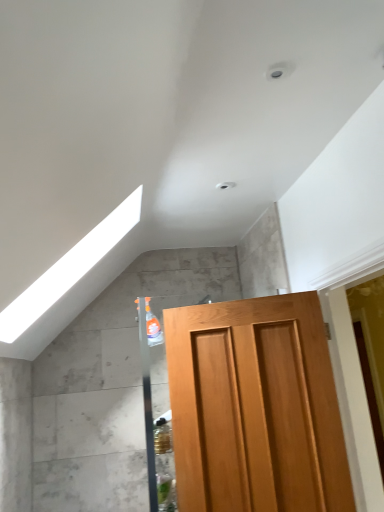
The width and height of the screenshot is (384, 512). What are the coordinates of `white glossy exhaust hood at upper left` in the screenshot? It's located at (69, 269).

In order to face white glossy exhaust hood at upper left, should I rotate leftwards or rightwards?

You should look left and rotate roughly 19.062 degrees.

What do you see at coordinates (69, 269) in the screenshot? I see `white glossy exhaust hood at upper left` at bounding box center [69, 269].

The width and height of the screenshot is (384, 512). What do you see at coordinates (255, 407) in the screenshot? I see `light brown wooden door at center` at bounding box center [255, 407].

Measure the distance between light brown wooden door at center and camera.

The distance of light brown wooden door at center from camera is 1.74 meters.

Find the location of a particular element. light brown wooden door at center is located at coordinates click(255, 407).

Where is `white glossy exhaust hood at upper left`? This screenshot has height=512, width=384. white glossy exhaust hood at upper left is located at coordinates (69, 269).

Between light brown wooden door at center and white glossy exhaust hood at upper left, which one appears on the left side from the viewer's perspective?

Positioned to the left is white glossy exhaust hood at upper left.

Relative to white glossy exhaust hood at upper left, is light brown wooden door at center in front or behind?

In the image, light brown wooden door at center appears behind white glossy exhaust hood at upper left.

Considering the positions of point (213, 366) and point (116, 229), is point (213, 366) closer or farther from the camera than point (116, 229)?

Point (213, 366) is closer to the camera than point (116, 229).

Consider the image. From the image's perspective, would you say light brown wooden door at center is positioned over white glossy exhaust hood at upper left?

No, from the image's perspective, light brown wooden door at center is not on top of white glossy exhaust hood at upper left.

From a real-world perspective, who is located higher, light brown wooden door at center or white glossy exhaust hood at upper left?

From a 3D spatial view, white glossy exhaust hood at upper left is above.

Consider the image. Can you confirm if light brown wooden door at center is wider than white glossy exhaust hood at upper left?

No.

From the picture: Is light brown wooden door at center shorter than white glossy exhaust hood at upper left?

Incorrect, the height of light brown wooden door at center does not fall short of that of white glossy exhaust hood at upper left.

Consider the image. Who is smaller, light brown wooden door at center or white glossy exhaust hood at upper left?

light brown wooden door at center.

Looking at this image, can we say light brown wooden door at center lies outside white glossy exhaust hood at upper left?

light brown wooden door at center is positioned outside white glossy exhaust hood at upper left.

Would you say light brown wooden door at center is a long distance from white glossy exhaust hood at upper left?

No.

Is light brown wooden door at center looking in the opposite direction of white glossy exhaust hood at upper left?

No, light brown wooden door at center is not facing the opposite direction of white glossy exhaust hood at upper left.

This screenshot has width=384, height=512. Find the location of `exhaust hood that is in front of the light brown wooden door at center`. exhaust hood that is in front of the light brown wooden door at center is located at coordinates (69, 269).

Based on their positions, is white glossy exhaust hood at upper left located to the left or right of light brown wooden door at center?

Based on their positions, white glossy exhaust hood at upper left is located to the left of light brown wooden door at center.

Which object is closer to the camera taking this photo, white glossy exhaust hood at upper left or light brown wooden door at center?

white glossy exhaust hood at upper left is closer to the camera.

Which is behind, point (70, 272) or point (215, 426)?

Point (70, 272)

From the image's perspective, is white glossy exhaust hood at upper left located above light brown wooden door at center?

Correct, white glossy exhaust hood at upper left appears higher than light brown wooden door at center in the image.

From a real-world perspective, is white glossy exhaust hood at upper left beneath light brown wooden door at center?

Actually, white glossy exhaust hood at upper left is physically above light brown wooden door at center in the real world.

Considering the sizes of white glossy exhaust hood at upper left and light brown wooden door at center in the image, is white glossy exhaust hood at upper left wider or thinner than light brown wooden door at center?

white glossy exhaust hood at upper left is wider than light brown wooden door at center.

Is white glossy exhaust hood at upper left shorter than light brown wooden door at center?

Yes, white glossy exhaust hood at upper left is shorter than light brown wooden door at center.

Does white glossy exhaust hood at upper left have a larger size compared to light brown wooden door at center?

Yes.

Can we say white glossy exhaust hood at upper left lies outside light brown wooden door at center?

Yes, white glossy exhaust hood at upper left is outside of light brown wooden door at center.

Based on the photo, is the surface of white glossy exhaust hood at upper left in direct contact with light brown wooden door at center?

white glossy exhaust hood at upper left and light brown wooden door at center are clearly separated.

Is white glossy exhaust hood at upper left positioned with its back to light brown wooden door at center?

That's not correct — white glossy exhaust hood at upper left is not looking away from light brown wooden door at center.

The width and height of the screenshot is (384, 512). Identify the location of exhaust hood that is above the light brown wooden door at center (from the image's perspective). (69, 269).

Image resolution: width=384 pixels, height=512 pixels. I want to click on door below the white glossy exhaust hood at upper left (from the image's perspective), so click(x=255, y=407).

Where is `exhaust hood lying above the light brown wooden door at center (from the image's perspective)`? The width and height of the screenshot is (384, 512). exhaust hood lying above the light brown wooden door at center (from the image's perspective) is located at coordinates (69, 269).